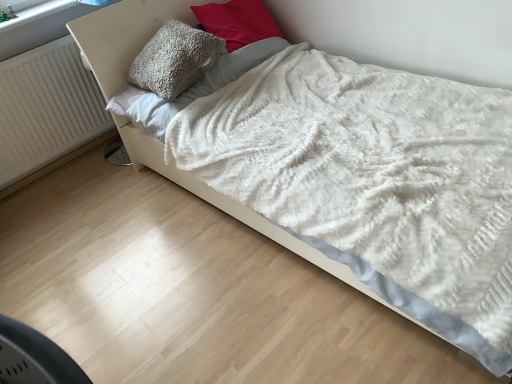
Question: Does fluffy gray pillow at upper center, positioned as the 1th pillow in left-to-right order, have a larger size compared to fuzzy gray pillow at upper center, the 1th pillow positioned from the right?

Choices:
 (A) yes
 (B) no

Answer: (B)

Question: Considering the relative sizes of fluffy gray pillow at upper center, which is counted as the second pillow, starting from the right, and fuzzy gray pillow at upper center, the 1th pillow positioned from the right, in the image provided, is fluffy gray pillow at upper center, which is counted as the second pillow, starting from the right, shorter than fuzzy gray pillow at upper center, the 1th pillow positioned from the right,?

Choices:
 (A) yes
 (B) no

Answer: (A)

Question: Does fluffy gray pillow at upper center, positioned as the 1th pillow in left-to-right order, have a greater height compared to fuzzy gray pillow at upper center, the 1th pillow positioned from the right?

Choices:
 (A) no
 (B) yes

Answer: (A)

Question: Does fluffy gray pillow at upper center, positioned as the 1th pillow in left-to-right order, have a lesser width compared to fuzzy gray pillow at upper center, the 1th pillow positioned from the right?

Choices:
 (A) no
 (B) yes

Answer: (A)

Question: Can you confirm if fluffy gray pillow at upper center, positioned as the 1th pillow in left-to-right order, is smaller than fuzzy gray pillow at upper center, which is the second pillow in left-to-right order?

Choices:
 (A) yes
 (B) no

Answer: (A)

Question: Is fluffy gray pillow at upper center, which is counted as the second pillow, starting from the right, aimed at fuzzy gray pillow at upper center, which is the second pillow in left-to-right order?

Choices:
 (A) yes
 (B) no

Answer: (B)

Question: Is fuzzy gray pillow at upper center, the 1th pillow positioned from the right, at the left side of fluffy gray pillow at upper center, which is counted as the second pillow, starting from the right?

Choices:
 (A) no
 (B) yes

Answer: (A)

Question: From the image's perspective, is fuzzy gray pillow at upper center, which is the second pillow in left-to-right order, located above fluffy gray pillow at upper center, positioned as the 1th pillow in left-to-right order?

Choices:
 (A) yes
 (B) no

Answer: (A)

Question: Does fuzzy gray pillow at upper center, the 1th pillow positioned from the right, have a greater width compared to fluffy gray pillow at upper center, which is counted as the second pillow, starting from the right?

Choices:
 (A) yes
 (B) no

Answer: (B)

Question: Is fuzzy gray pillow at upper center, which is the second pillow in left-to-right order, facing towards fluffy gray pillow at upper center, which is counted as the second pillow, starting from the right?

Choices:
 (A) yes
 (B) no

Answer: (B)

Question: Is fuzzy gray pillow at upper center, which is the second pillow in left-to-right order, in contact with fluffy gray pillow at upper center, positioned as the 1th pillow in left-to-right order?

Choices:
 (A) no
 (B) yes

Answer: (A)

Question: From a real-world perspective, is fuzzy gray pillow at upper center, which is the second pillow in left-to-right order, located beneath fluffy gray pillow at upper center, positioned as the 1th pillow in left-to-right order?

Choices:
 (A) no
 (B) yes

Answer: (B)

Question: Is white ribbed radiator at left completely or partially outside of fuzzy gray pillow at upper center, which is the second pillow in left-to-right order?

Choices:
 (A) no
 (B) yes

Answer: (B)